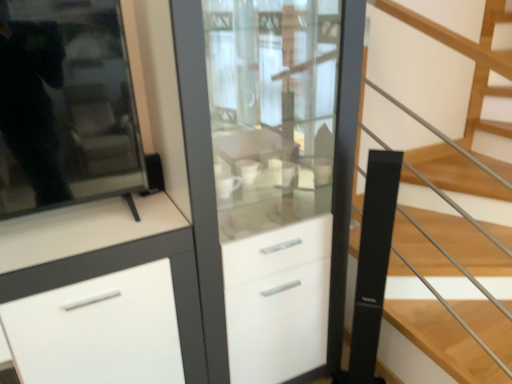
Question: Considering the relative sizes of white glossy cabinet at center and white matte cabinet at center in the image provided, is white glossy cabinet at center shorter than white matte cabinet at center?

Choices:
 (A) yes
 (B) no

Answer: (B)

Question: Is white glossy cabinet at center to the left of white matte cabinet at center from the viewer's perspective?

Choices:
 (A) no
 (B) yes

Answer: (A)

Question: From a real-world perspective, is white glossy cabinet at center beneath white matte cabinet at center?

Choices:
 (A) yes
 (B) no

Answer: (B)

Question: Is white glossy cabinet at center not close to white matte cabinet at center?

Choices:
 (A) yes
 (B) no

Answer: (B)

Question: Considering the relative sizes of white glossy cabinet at center and white matte cabinet at center in the image provided, is white glossy cabinet at center wider than white matte cabinet at center?

Choices:
 (A) yes
 (B) no

Answer: (B)

Question: Is white matte cabinet at center at the back of white glossy cabinet at center?

Choices:
 (A) no
 (B) yes

Answer: (A)

Question: Is white matte cabinet at center bigger than white glossy cabinet at center?

Choices:
 (A) yes
 (B) no

Answer: (B)

Question: From the image's perspective, would you say white matte cabinet at center is positioned over white glossy cabinet at center?

Choices:
 (A) no
 (B) yes

Answer: (A)

Question: Does white matte cabinet at center lie in front of white glossy cabinet at center?

Choices:
 (A) yes
 (B) no

Answer: (A)

Question: Does white matte cabinet at center appear on the right side of white glossy cabinet at center?

Choices:
 (A) yes
 (B) no

Answer: (B)

Question: Does white matte cabinet at center have a smaller size compared to white glossy cabinet at center?

Choices:
 (A) yes
 (B) no

Answer: (A)

Question: Considering the relative positions of white matte cabinet at center and white glossy cabinet at center in the image provided, is white matte cabinet at center behind white glossy cabinet at center?

Choices:
 (A) no
 (B) yes

Answer: (A)

Question: Is white glossy cabinet at center positioned far away from black matte stair at center?

Choices:
 (A) yes
 (B) no

Answer: (B)